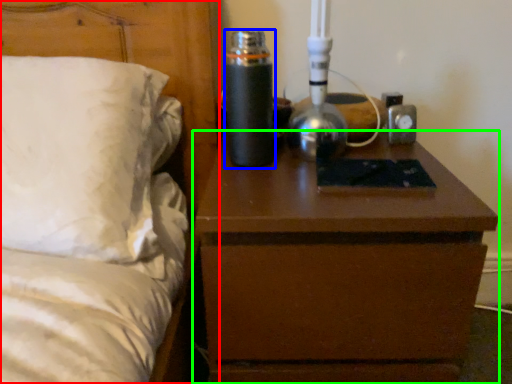
Question: Which object is the closest to the bed (highlighted by a red box)? Choose among these: bottle (highlighted by a blue box) or nightstand (highlighted by a green box).

Choices:
 (A) bottle
 (B) nightstand

Answer: (A)